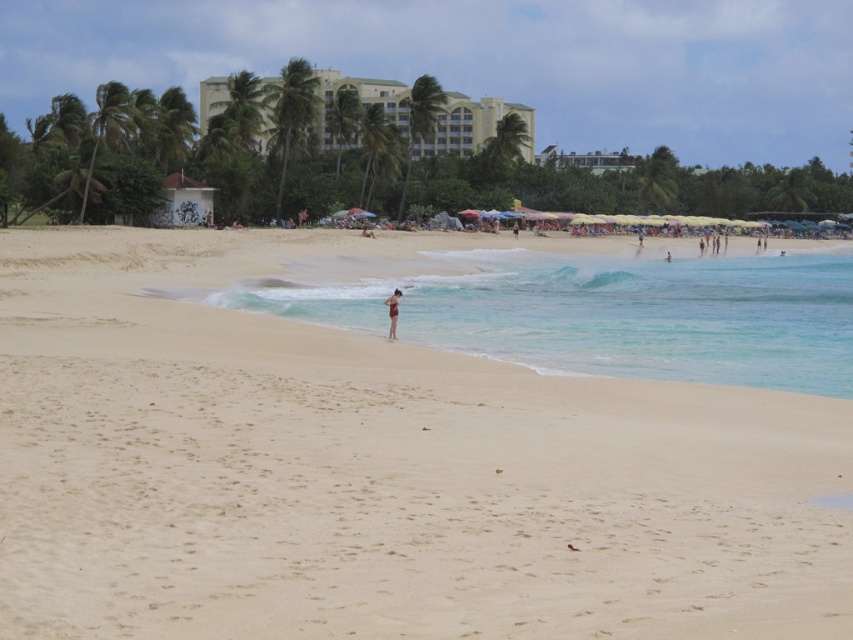
You are standing at the origin point of the coordinate system. You want to walk to the clear blue water at center. Which direction should you go?

Answer: The clear blue water at center is located at point (611, 314) in the 2D coordinate system, so you should walk towards the direction of the coordinates (611, 314) to reach it.

You are a lifeguard on duty and need to assess the distance between the clear blue water at center and the smooth tan skin at center. Based on the scene, can you confirm if the distance is more than 20 meters?

The clear blue water at center and smooth tan skin at center are 19.13 meters apart from each other, so the distance is less than 20 meters.

You are a lifeguard on duty and notice someone lying on the beach. You see the light beige sand at center and the smooth tan skin at center. Which object is located below the other?

The light beige sand at center is positioned under smooth tan skin at center.